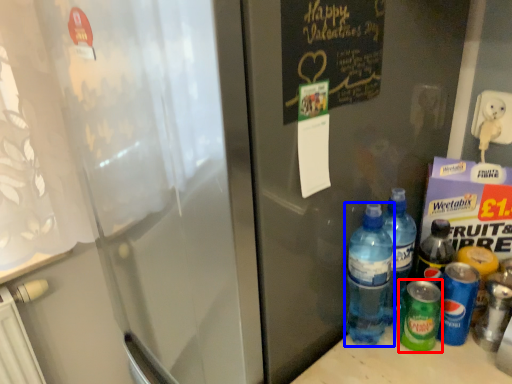
Question: Which object is further to the camera taking this photo, bottle (highlighted by a red box) or bottle (highlighted by a blue box)?

Choices:
 (A) bottle
 (B) bottle

Answer: (A)